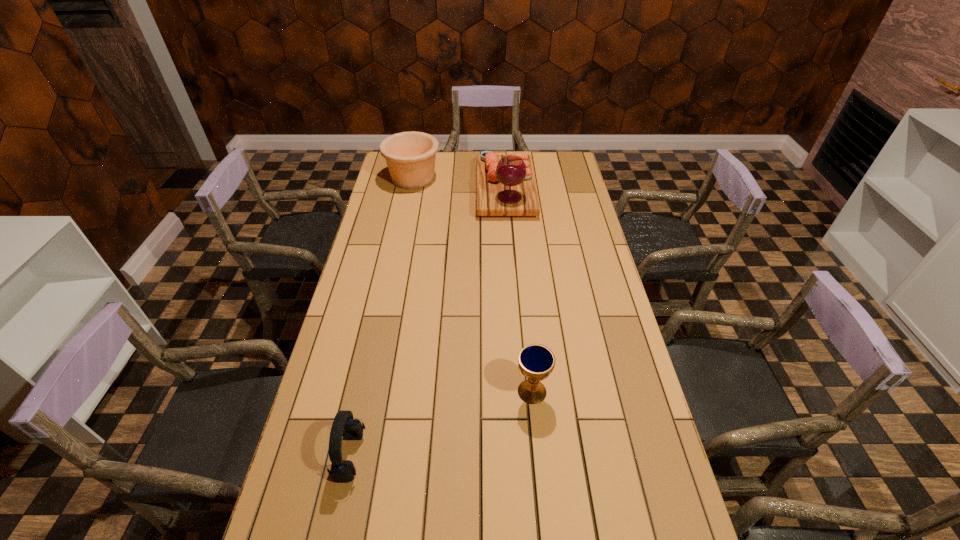
The image size is (960, 540). Find the location of `platter`. platter is located at coordinates (505, 184).

I want to click on pottery, so click(x=410, y=156).

I want to click on the second nearest object, so click(x=536, y=362).

You are a GUI agent. You are given a task and a screenshot of the screen. Output one action in this format:
    pyautogui.click(x=<x>, y=<y>)
    Task: Click on the headset
    The image size is (960, 540).
    Given the screenshot: What is the action you would take?
    pyautogui.click(x=344, y=425)

Image resolution: width=960 pixels, height=540 pixels. I want to click on free space located 0.140m on the right of the platter, so click(565, 190).

Where is `vacant space positioned 0.210m on the front of the pottery`? The width and height of the screenshot is (960, 540). vacant space positioned 0.210m on the front of the pottery is located at coordinates (404, 222).

Find the location of a particular element. The image size is (960, 540). vacant space located on the front of the chalice is located at coordinates (542, 500).

This screenshot has width=960, height=540. I want to click on vacant point located on the headband of the headset, so click(486, 456).

The height and width of the screenshot is (540, 960). I want to click on platter that is at the far edge, so click(505, 184).

Locate an element on the screen. This screenshot has height=540, width=960. pottery located in the far edge section of the desktop is located at coordinates coord(410,156).